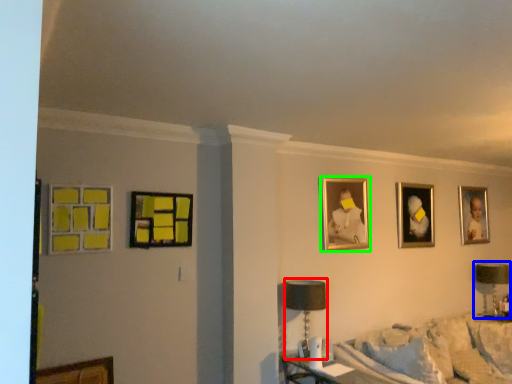
Question: Based on their relative distances, which object is farther from table lamp (highlighted by a red box)? Choose from table lamp (highlighted by a blue box) and picture frame (highlighted by a green box).

Choices:
 (A) table lamp
 (B) picture frame

Answer: (A)